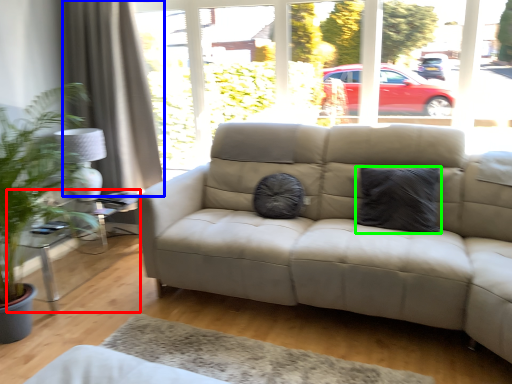
Question: Which object is positioned closest to table (highlighted by a red box)? Select from curtain (highlighted by a blue box) and pillow (highlighted by a green box).

Choices:
 (A) curtain
 (B) pillow

Answer: (A)